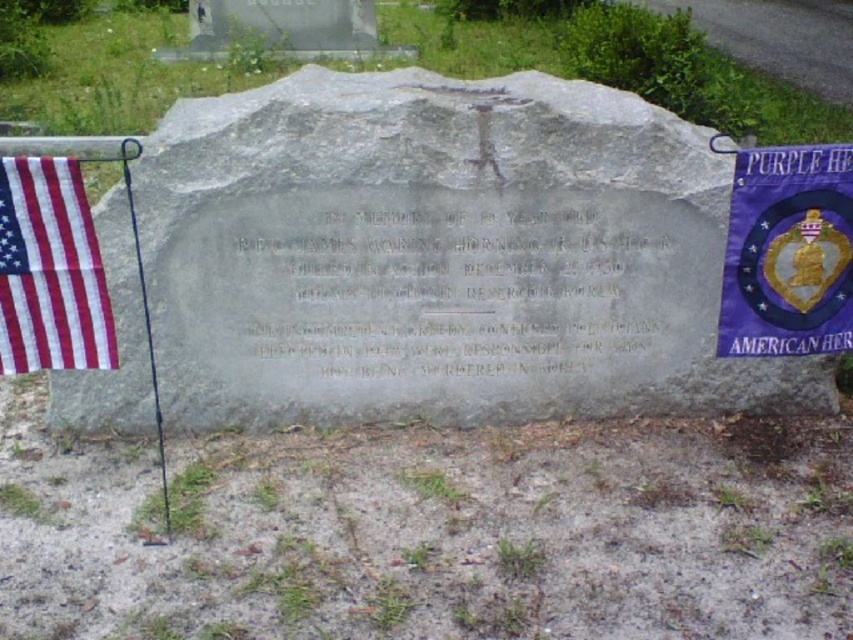
Question: Does gray stone at center appear under purple fabric banner at upper right?

Choices:
 (A) no
 (B) yes

Answer: (A)

Question: Does gray stone at center appear on the right side of american fabric flag at left?

Choices:
 (A) yes
 (B) no

Answer: (A)

Question: Does gray stone at center appear over american fabric flag at left?

Choices:
 (A) no
 (B) yes

Answer: (B)

Question: Which of these objects is positioned farthest from the american fabric flag at left?

Choices:
 (A) gray stone at center
 (B) purple fabric banner at upper right

Answer: (B)

Question: Which object is farther from the camera taking this photo?

Choices:
 (A) purple fabric banner at upper right
 (B) american fabric flag at left

Answer: (A)

Question: Which point appears closest to the camera in this image?

Choices:
 (A) (735, 212)
 (B) (33, 163)
 (C) (521, 230)

Answer: (B)